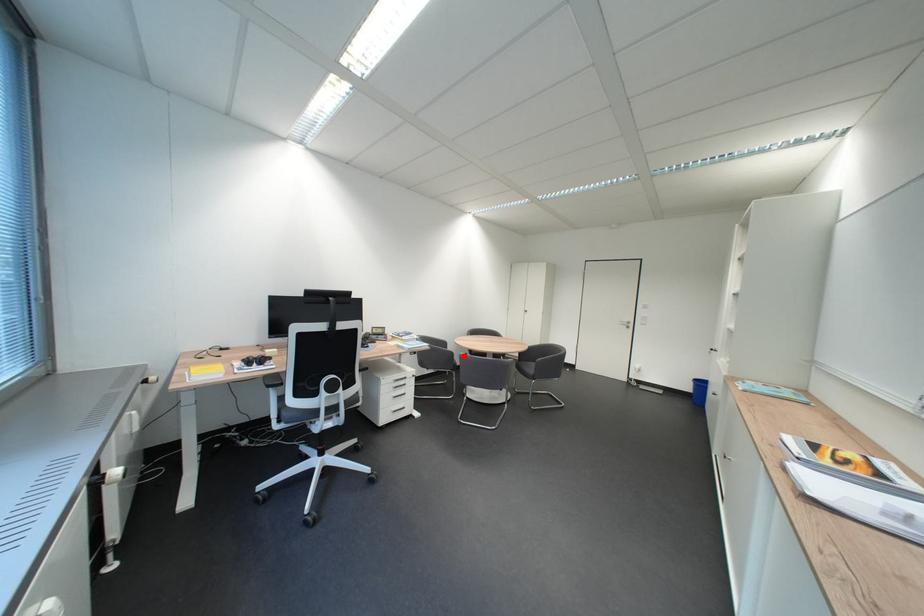
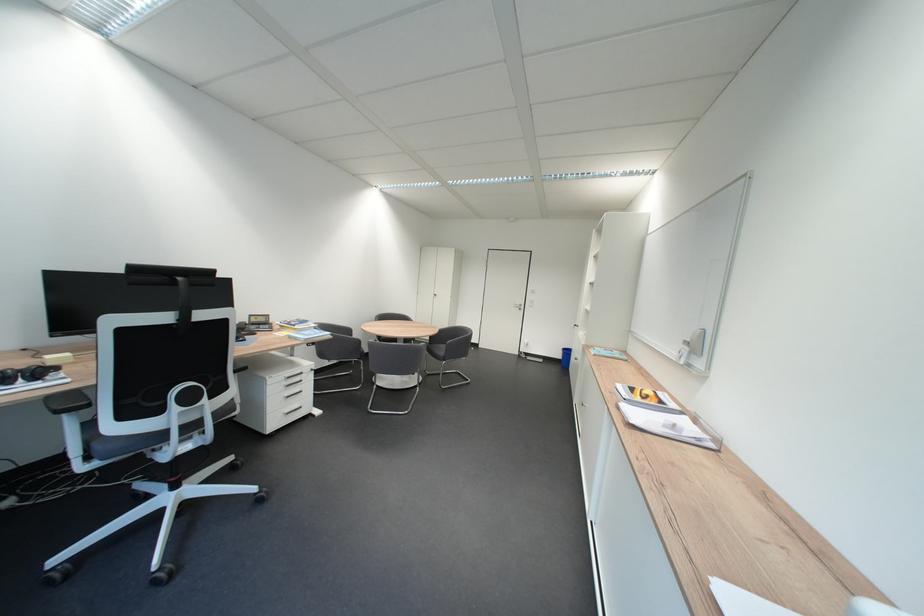
Find the pixel in the second image that matches the highlighted location in the first image.

(371, 342)